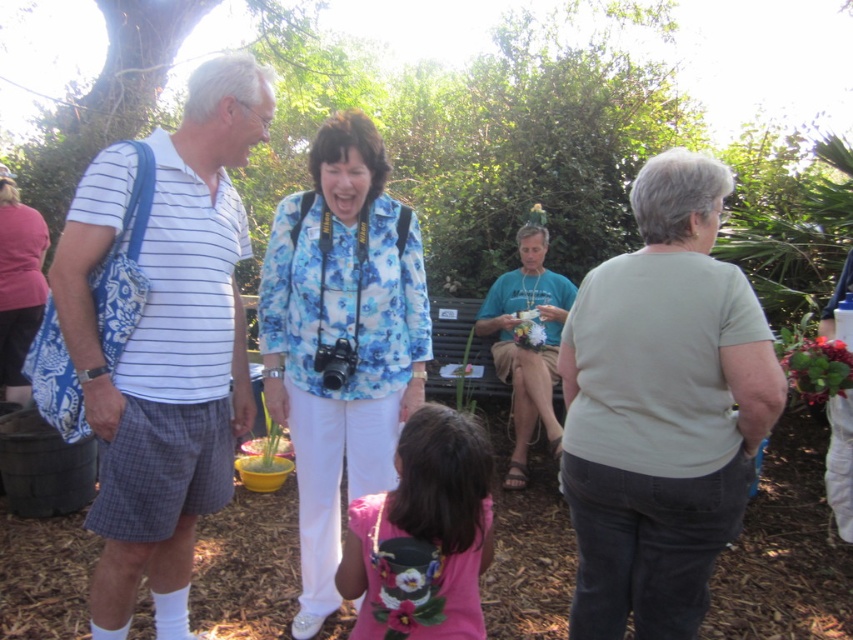
You are a photographer at the park and notice the white striped shirt at left and the matte blue bag at left. Which object is positioned lower in the image?

The white striped shirt at left is located below matte blue bag at left, so the white striped shirt at left is positioned lower in the image.

You are a photographer taking pictures of the people in the park. You notice two individuals wearing a light gray cotton shirt at center and a white striped shirt at left. Which one is positioned lower in the frame?

The light gray cotton shirt at center is located below the white striped shirt at left, so the light gray cotton shirt at center is positioned lower in the frame.

You are a photographer at the park and need to capture a wide shot of both the white striped shirt at left and the matte blue bag at left. Based on their positions, do you think you can fit both into your camera frame without moving closer or farther away?

The distance between the white striped shirt at left and the matte blue bag at left is 3.29 meters. Since the camera frame can typically accommodate objects spaced this far apart in a wide shot, you should be able to include both in the frame without adjusting your position.